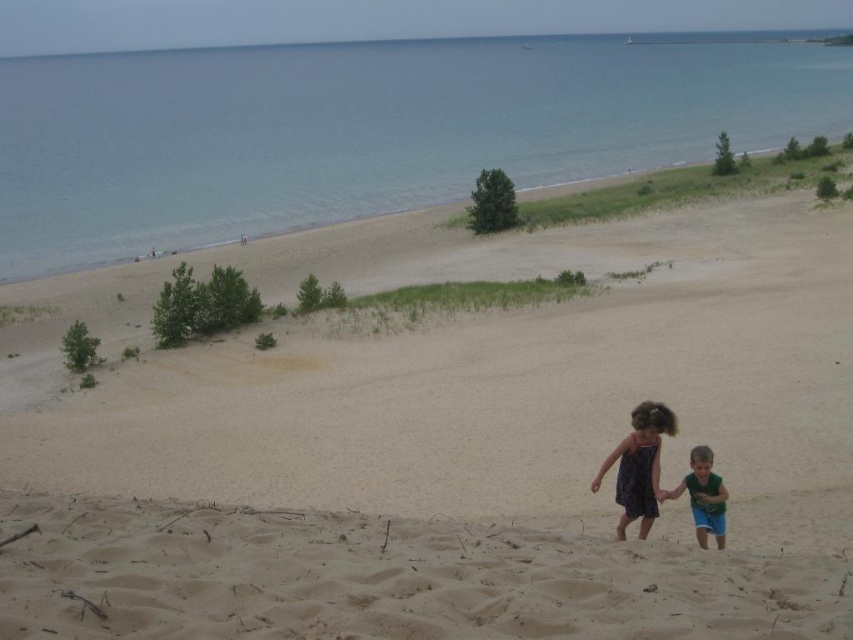
Question: Does blue water at upper center have a smaller size compared to green cotton shirt at lower right?

Choices:
 (A) yes
 (B) no

Answer: (B)

Question: Considering the real-world distances, which object is farthest from the green cotton shirt at lower right?

Choices:
 (A) blue water at upper center
 (B) dark purple dress at lower center
 (C) beige sandy beach at center

Answer: (A)

Question: Based on their relative distances, which object is nearer to the dark purple dress at lower center?

Choices:
 (A) green cotton shirt at lower right
 (B) beige sandy beach at center
 (C) blue water at upper center

Answer: (A)

Question: Which of the following is the farthest from the observer?

Choices:
 (A) (618, 484)
 (B) (700, 547)
 (C) (236, 131)
 (D) (242, 612)

Answer: (C)

Question: Is beige sandy beach at center further to camera compared to green cotton shirt at lower right?

Choices:
 (A) no
 (B) yes

Answer: (A)

Question: Does blue water at upper center appear on the left side of dark purple dress at lower center?

Choices:
 (A) yes
 (B) no

Answer: (A)